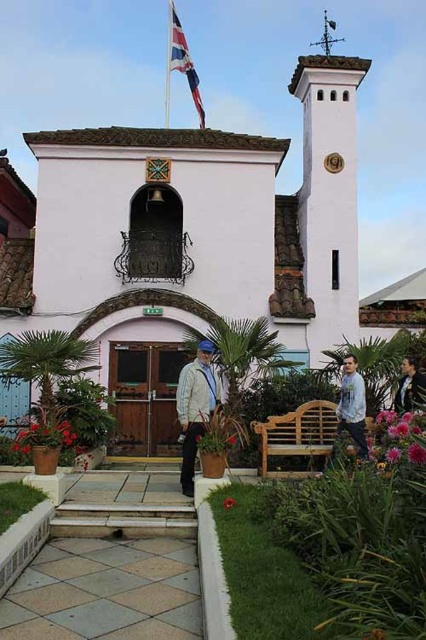
You are standing at the entrance of the white building and want to reach both points marked on the image. Which point, point (x=164, y=173) or point (x=354, y=364), is closer to you?

Point (x=354, y=364) is closer to you because it is in front of point (x=164, y=173) according to their spatial arrangement.